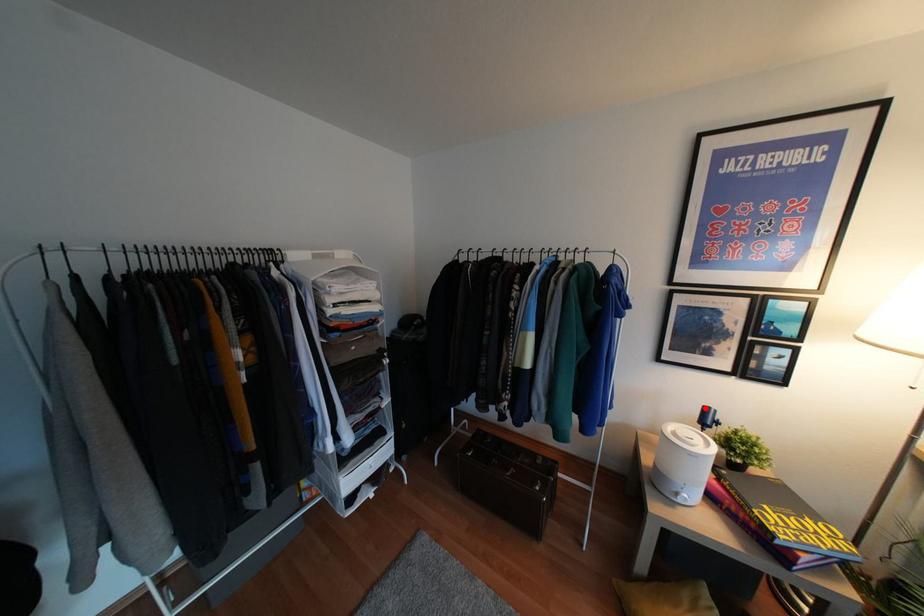
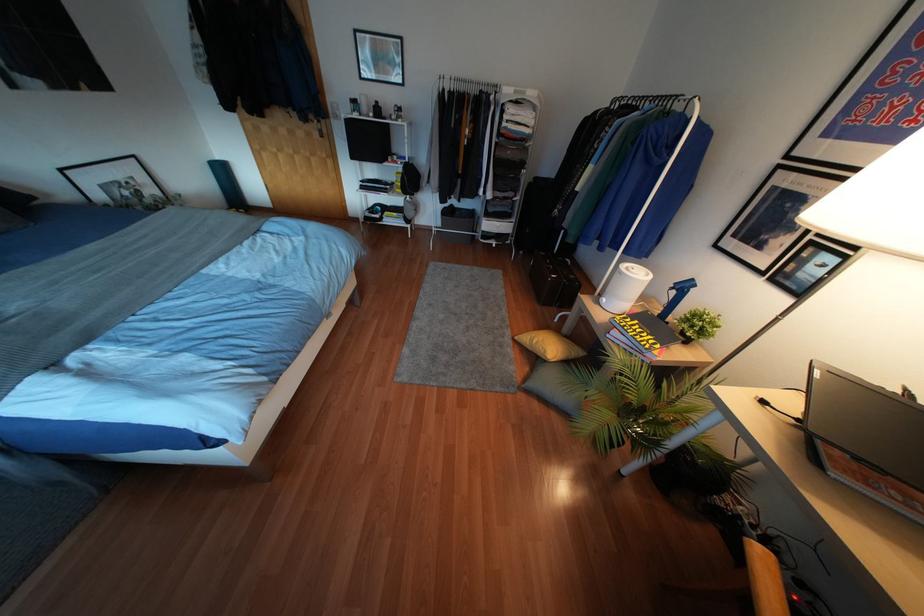
Question: I am providing you with two images of the same scene from different viewpoints. In image1, a red point is highlighted. Considering the same 3D point in image2, which of the following is correct?

Choices:
 (A) It is closer
 (B) It is farther

Answer: (A)